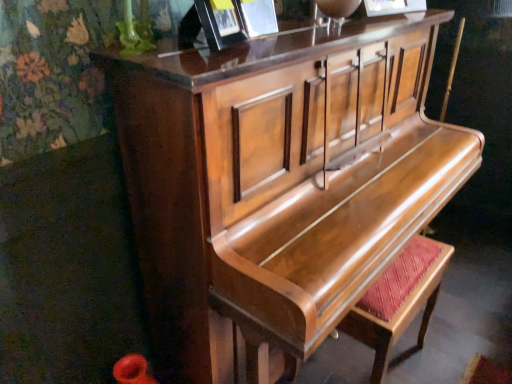
Image resolution: width=512 pixels, height=384 pixels. I want to click on wooden armchair at lower right, so click(x=399, y=301).

What do you see at coordinates (399, 301) in the screenshot?
I see `wooden armchair at lower right` at bounding box center [399, 301].

The height and width of the screenshot is (384, 512). What are the coordinates of `wooden armchair at lower right` in the screenshot? It's located at point(399,301).